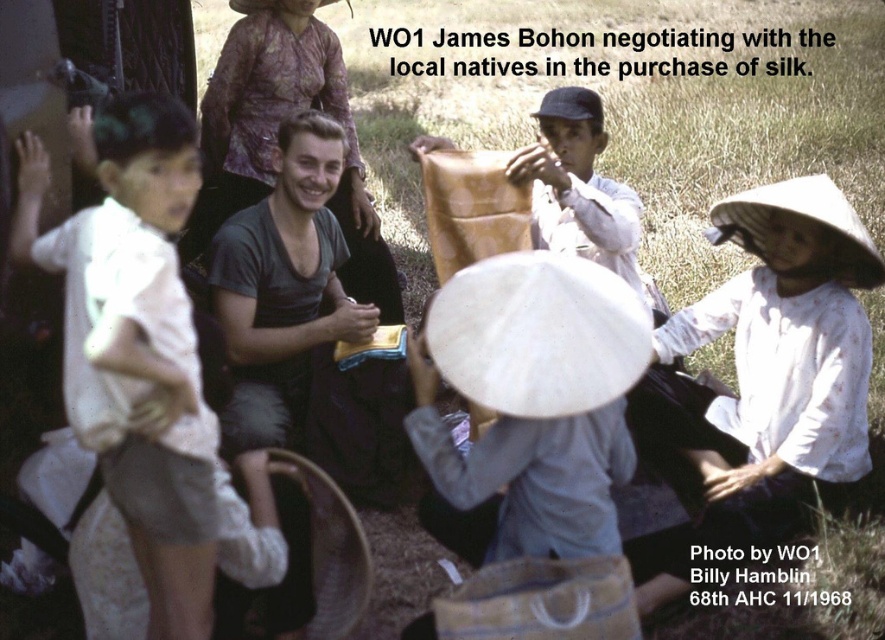
You are a photographer standing in the scene and want to take a photo of both the printed silk dress at upper center and the light brown fabric at center. Which object should you focus on first to ensure both are in clear view?

The printed silk dress at upper center is further to the viewer than the light brown fabric at center, so you should focus on the printed silk dress at upper center first to ensure both are in clear view.

You are a fashion designer observing the scene. You notice the printed silk dress at upper center and the light brown fabric at center. Which fabric item is wider?

The printed silk dress at upper center might be wider than light brown fabric at center.